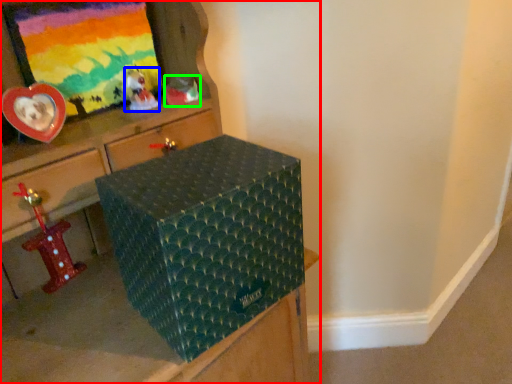
Question: Based on their relative distances, which object is farther from furniture (highlighted by a red box)? Choose from toy (highlighted by a blue box) and toy (highlighted by a green box).

Choices:
 (A) toy
 (B) toy

Answer: (A)